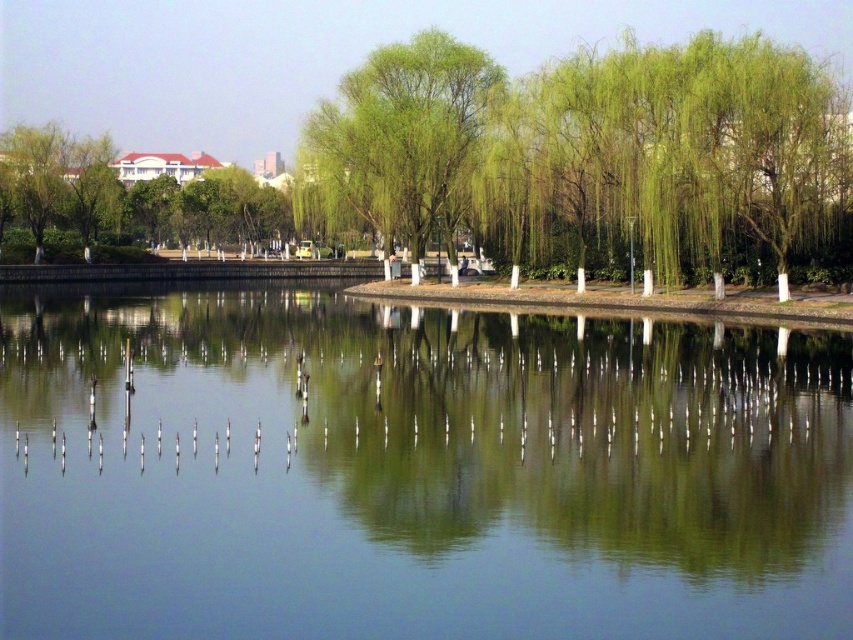
You are standing at the lakeside and see two points marked on the image. The first point is at coordinates point (265,346) and the second is at point (355,205). Which point is closer to you?

Point (265,346) is in front of point (355,205), so the first point is closer to you.

From the picture: You are standing at the lakeside and want to place a small wooden boat in the water. The boat requires a space wider than the green leafy willow at center to fit. Can the clear water at center provide enough width for the boat?

The clear water at center is wider than the green leafy willow at center, so yes, the clear water at center can provide enough width for the boat.